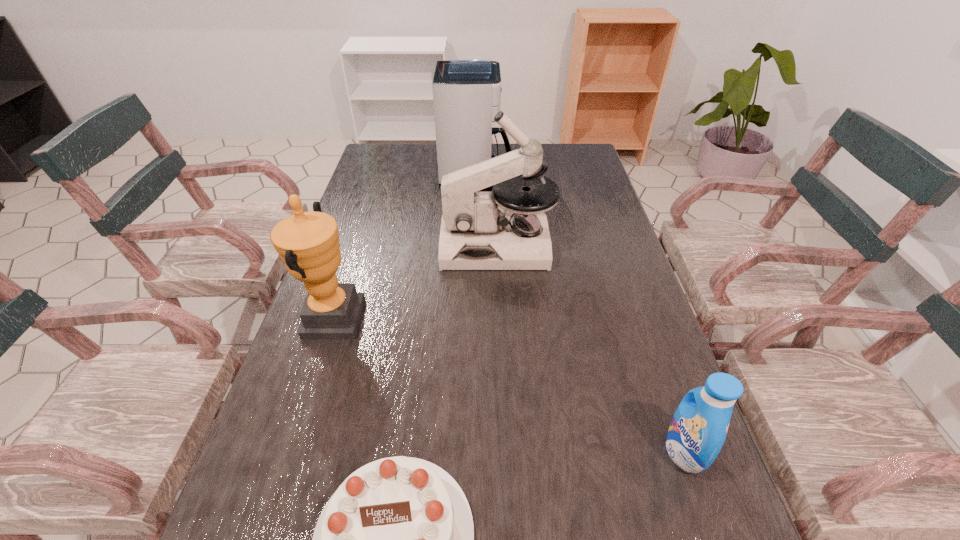
Find the location of `microscope`. microscope is located at coordinates (479, 230).

Where is `the farthest object`? the farthest object is located at coordinates (466, 92).

At what (x,y) coordinates should I click in order to perform the action: click on award. Please return your answer as a coordinate pair (x, y). The width and height of the screenshot is (960, 540). Looking at the image, I should click on (307, 242).

Identify the location of the leftmost object. (307, 242).

Find the location of `detergent`. detergent is located at coordinates (698, 429).

The width and height of the screenshot is (960, 540). What are the coordinates of `the rightmost object` in the screenshot? It's located at (698, 429).

You are a GUI agent. You are given a task and a screenshot of the screen. Output one action in this format:
    pyautogui.click(x=<x>, y=<y>)
    Task: Click on the vacant space situated 0.170m at the eyepiece of the fourth nearest object
    The height and width of the screenshot is (540, 960).
    Given the screenshot: What is the action you would take?
    pyautogui.click(x=382, y=246)

What are the coordinates of `blank space located at the eyepiece of the fourth nearest object` in the screenshot? It's located at (378, 246).

I want to click on free spot located at the eyepiece of the fourth nearest object, so click(350, 246).

Where is `free point located 0.080m on the front panel of the coffee maker`? free point located 0.080m on the front panel of the coffee maker is located at coordinates (535, 176).